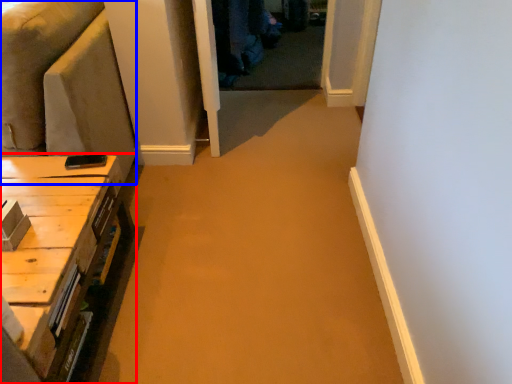
Question: Which point is further to the camera, table (highlighted by a red box) or couch (highlighted by a blue box)?

Choices:
 (A) table
 (B) couch

Answer: (B)